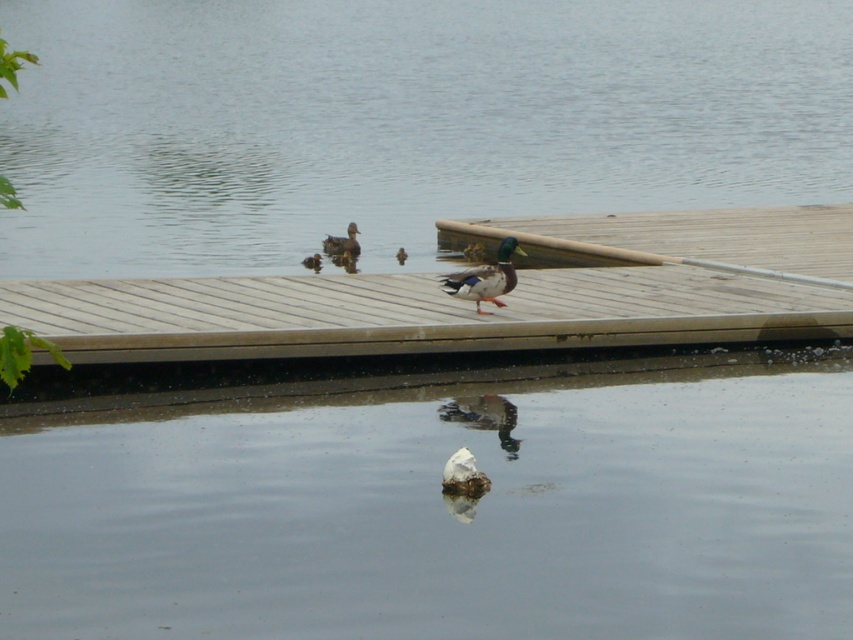
You are observing a group of ducks on a wooden dock. You see a brown fuzzy duckling at upper center and a brown fuzzy duckling at center. Which duckling is positioned higher up in the scene?

The brown fuzzy duckling at upper center is positioned higher up in the scene than the brown fuzzy duckling at center.